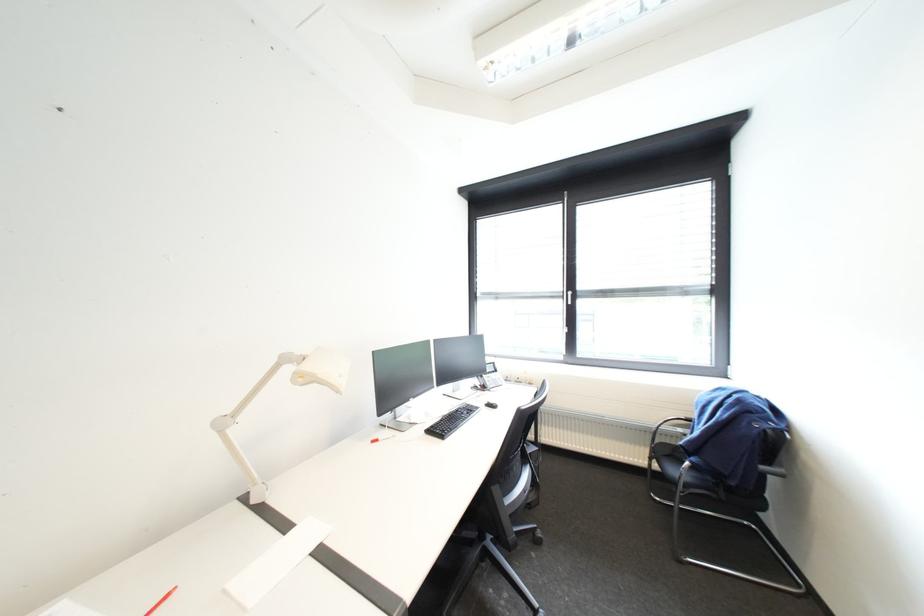
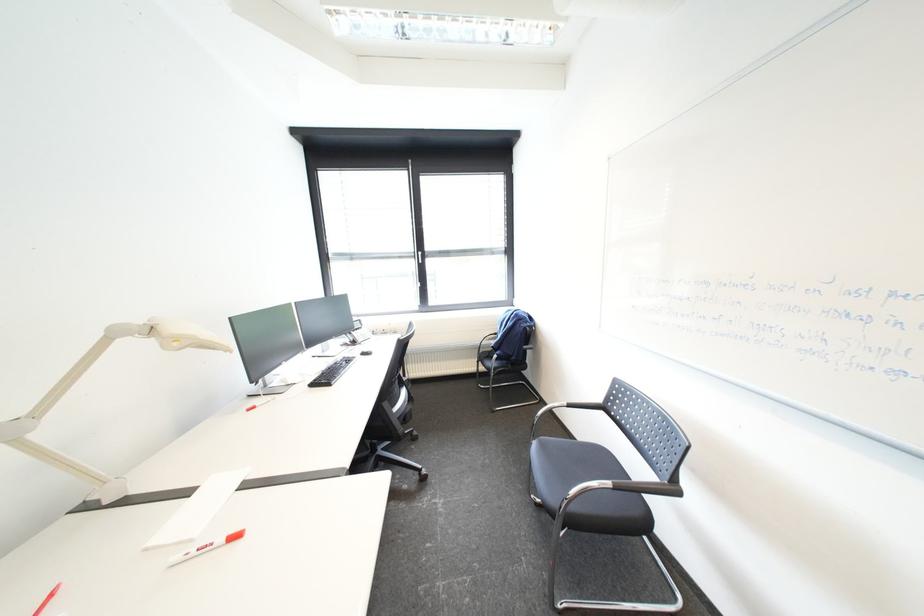
Question: The camera is either moving clockwise (left) or counter-clockwise (right) around the object. The first image is from the beginning of the video and the second image is from the end. Is the camera moving left or right when shooting the video?

Choices:
 (A) Left
 (B) Right

Answer: (A)